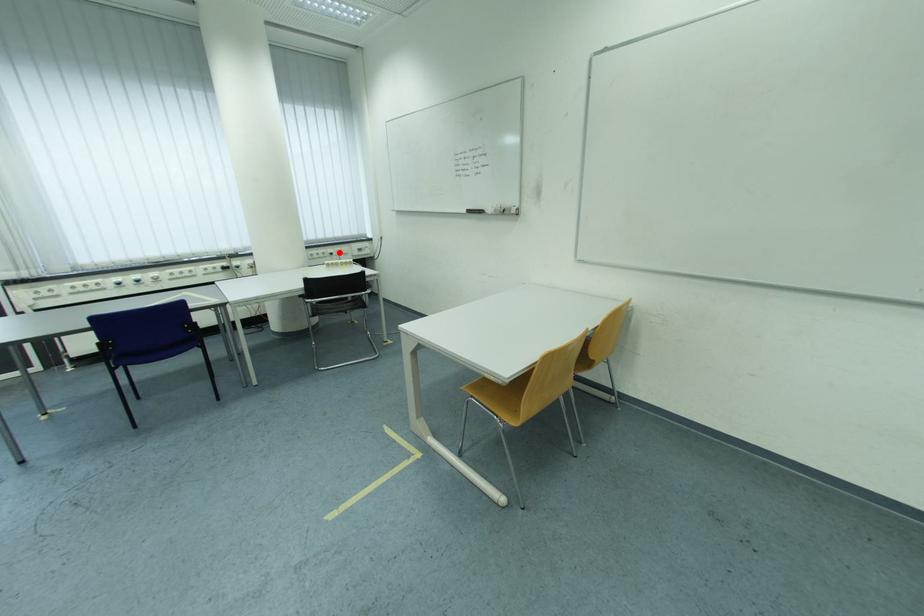
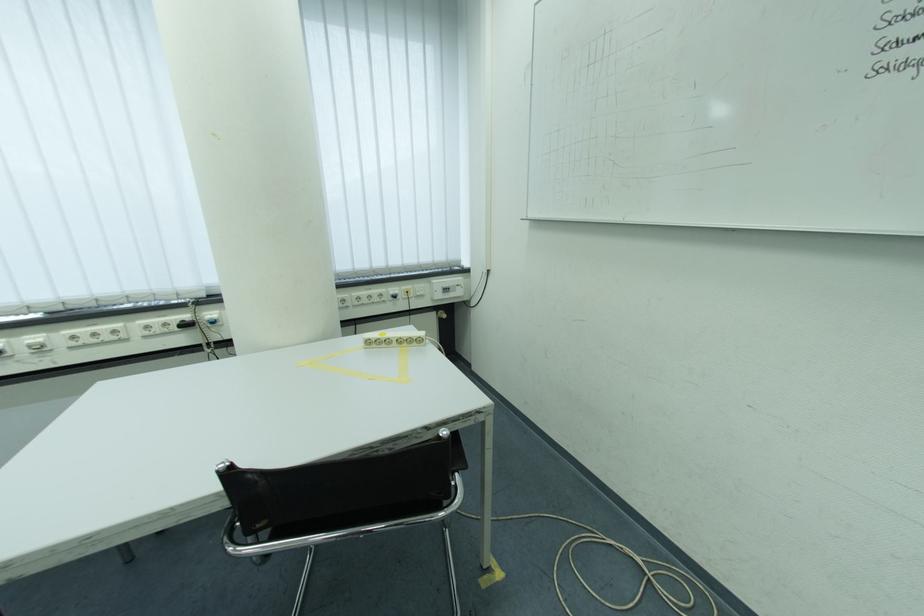
The point at the highlighted location is marked in the first image. Where is the corresponding point in the second image?

(402, 291)